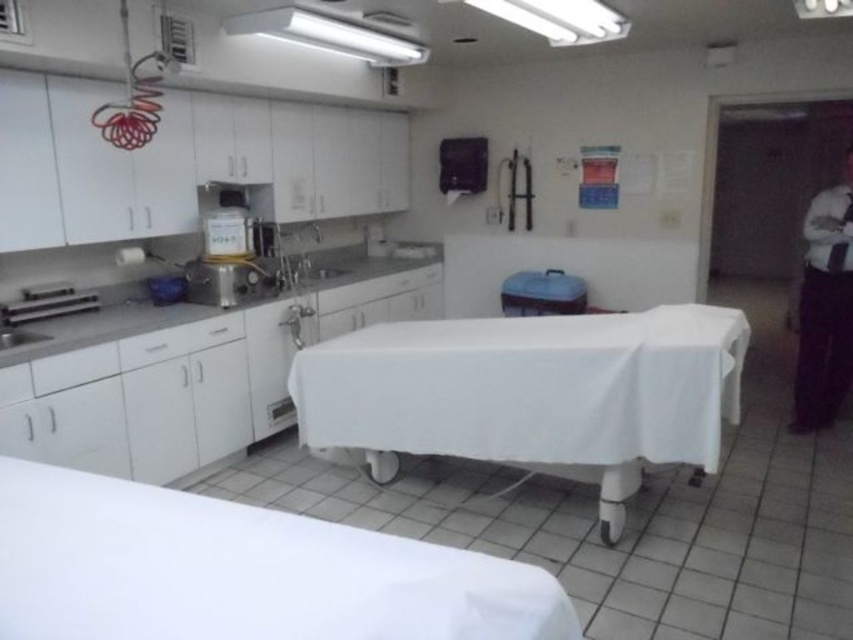
Based on the photo, you are a medical assistant standing in the center of the room. You need to reach both the point at coordinates point (625, 476) and point (403, 64). Which point will you reach first?

You will reach point (625, 476) first because it is closer to you than point (403, 64).

You are a medical assistant standing at the entrance of the examination room. You need to move a medical chart from the point at coordinates point [544,608] to the point at coordinates point [509,362]. Which direction should you move the chart relative to the stainless steel sink on the left side?

Since point [544,608] is in front of point [509,362], you should move the medical chart backward towards the stainless steel sink on the left side.